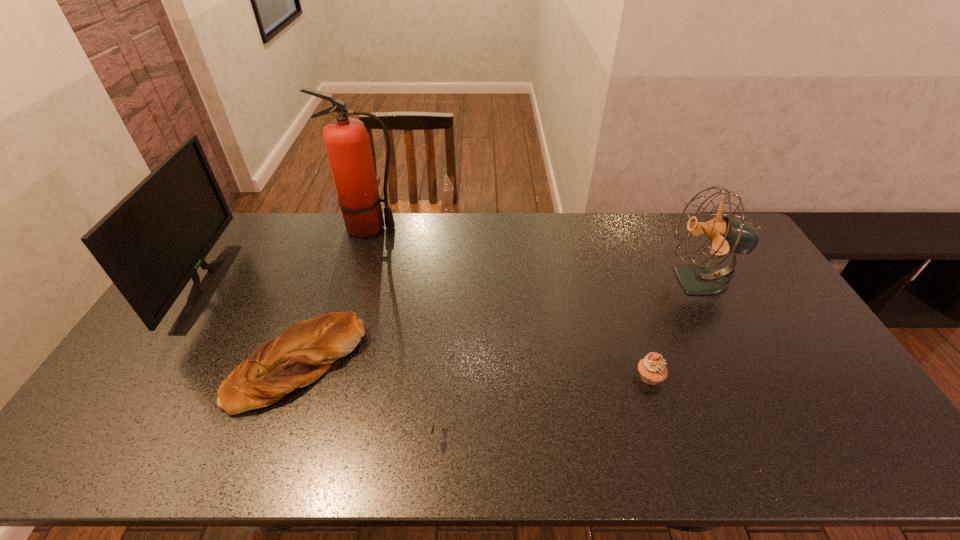
Find the location of a particular element. Image resolution: width=960 pixels, height=540 pixels. vacant area located 0.130m on the front-facing side of the third tallest object for air flow is located at coordinates (626, 281).

You are a GUI agent. You are given a task and a screenshot of the screen. Output one action in this format:
    pyautogui.click(x=<x>, y=<y>)
    Task: Click on the free space located 0.220m on the front-facing side of the third tallest object for air flow
    This screenshot has width=960, height=540.
    Given the screenshot: What is the action you would take?
    pyautogui.click(x=598, y=281)

Where is `vacant space positioned 0.180m on the front-facing side of the third tallest object for air flow`? The height and width of the screenshot is (540, 960). vacant space positioned 0.180m on the front-facing side of the third tallest object for air flow is located at coordinates (611, 281).

This screenshot has width=960, height=540. What are the coordinates of `vacant space situated 0.340m on the back of the fifth object from left to right` in the screenshot? It's located at (617, 280).

Where is `vacant space located on the right of the bread`? The image size is (960, 540). vacant space located on the right of the bread is located at coordinates (469, 364).

This screenshot has height=540, width=960. Identify the location of free spot located 0.250m in front of the lenses of the third object from right to left. (540, 434).

Locate an element on the screen. fire extinguisher that is positioned at the far edge is located at coordinates (347, 141).

Find the location of a particular element. monitor that is at the far edge is located at coordinates (151, 244).

The height and width of the screenshot is (540, 960). In order to click on object that is at the near edge in this screenshot , I will do `click(432, 428)`.

This screenshot has height=540, width=960. What are the coordinates of `object that is at the left edge` in the screenshot? It's located at (151, 244).